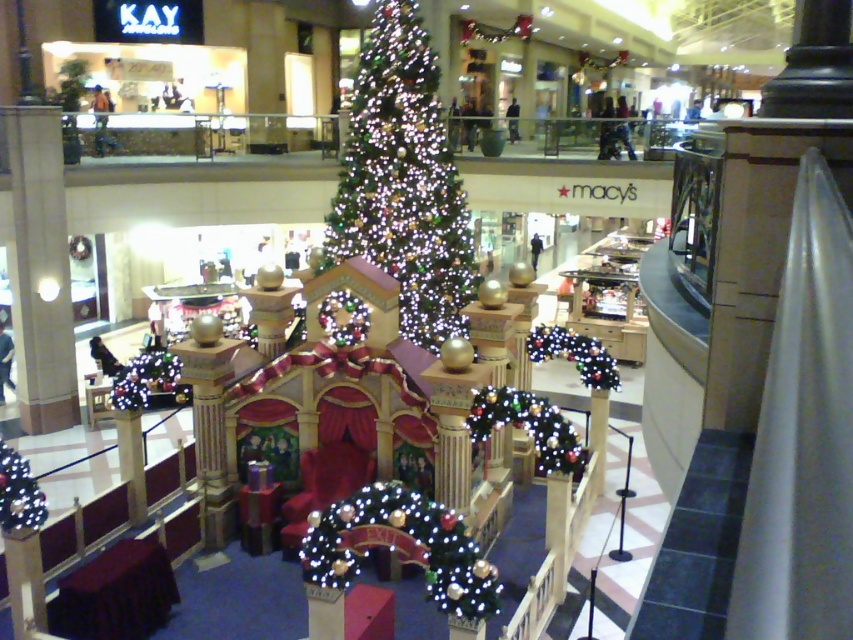
You are standing in the mall and want to locate the illuminated fabric archway at center. According to the coordinates provided, where should you look?

The illuminated fabric archway at center is located at point (399, 547).

You are a photographer planning to capture the festive scene at the mall. You want to ensure that both the iridescent glass christmas tree at center and the illuminated fabric archway at center are clearly visible in your shot. Given that your camera has a fixed focal length, which object should you position closer to the camera to ensure both are in frame without cropping?

Since the iridescent glass christmas tree at center is wider than the illuminated fabric archway at center, you should position the iridescent glass christmas tree at center closer to the camera. This will help maintain both objects within the frame without cropping, as wider objects require more space when closer to the lens.

You are standing at the entrance of the mall and want to take a photo of both the illuminated fabric archway at center and the illuminated plastic garland at lower left. Which object should you position yourself closer to in order to capture both in the same frame?

To capture both the illuminated fabric archway at center and the illuminated plastic garland at lower left in the same frame, you should position yourself closer to the illuminated plastic garland at lower left since the illuminated fabric archway at center is to the right of it, allowing both to be included within the camera frame.